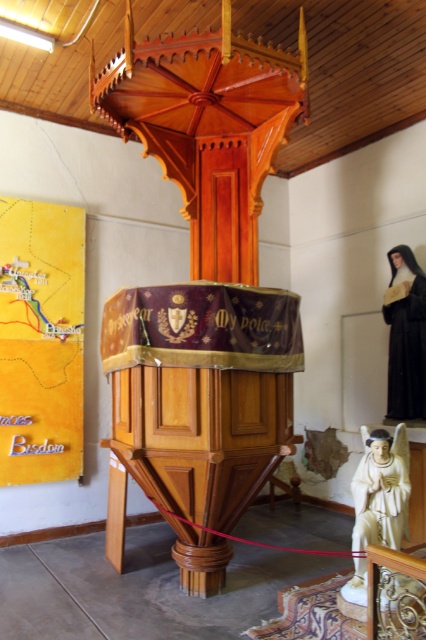
You are an interior designer planning to place a new decorative item between the white marble statue at lower right and the dark brown woolen robe at right. Based on their widths, which object should you consider moving to ensure there is enough space?

The white marble statue at lower right might be wider than the dark brown woolen robe at right, so moving the dark brown woolen robe at right would allow more space for the new decorative item.

You are an interior designer planning to rearrange the items in the church. You need to know which item takes up more floor space. Which one is larger in size between the white marble statue at lower right and the dark brown woolen robe at right?

The white marble statue at lower right occupies less space than dark brown woolen robe at right, so the dark brown woolen robe at right is larger in size.